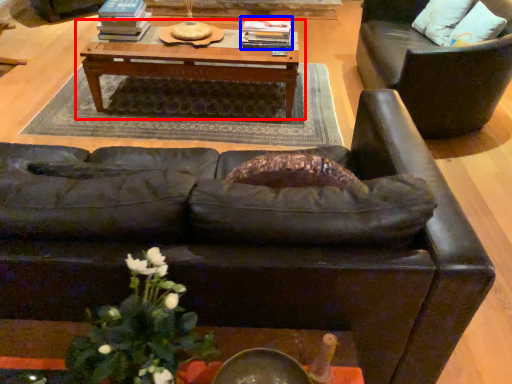
Question: Which point is further to the camera, table (highlighted by a red box) or book (highlighted by a blue box)?

Choices:
 (A) table
 (B) book

Answer: (B)